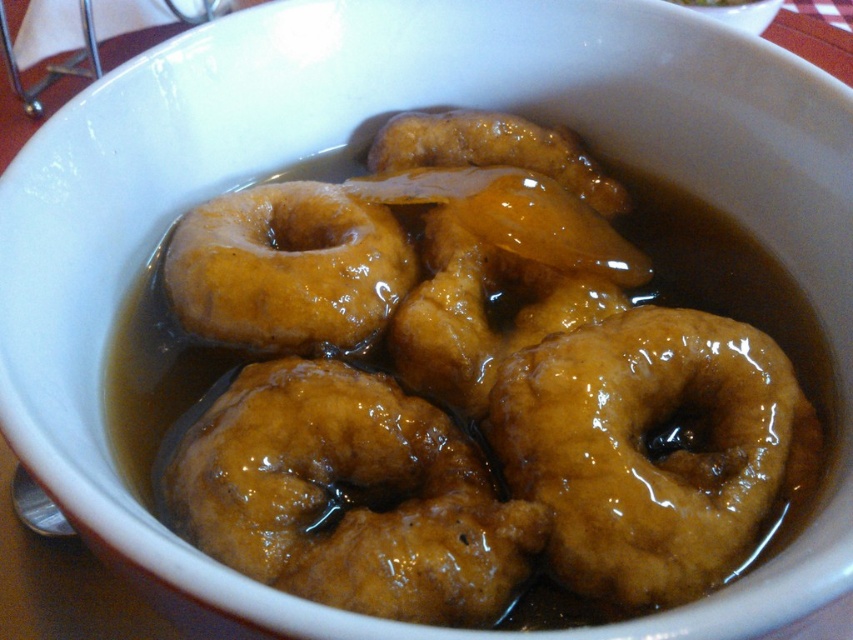
How much distance is there between glossy golden donut at center and golden glazed donut at center?

glossy golden donut at center is 5.85 inches away from golden glazed donut at center.

Between glossy golden donut at center and golden glazed donut at center, which one is positioned higher?

golden glazed donut at center is higher up.

Is point (213, 515) behind point (225, 230)?

No, (213, 515) is in front of (225, 230).

This screenshot has width=853, height=640. In order to click on glossy golden donut at center in this screenshot , I will do `click(350, 497)`.

Between point (653, 426) and point (260, 227), which one is positioned behind?

The point (260, 227) is behind.

Is golden brown glazed donut at center shorter than golden glazed donut at center?

In fact, golden brown glazed donut at center may be taller than golden glazed donut at center.

Measure the distance between point (605,387) and camera.

The distance of point (605,387) from camera is 61.31 centimeters.

Identify the location of golden brown glazed donut at center. (646, 448).

Which is more to the left, glossy golden donut at center or golden brown glazed donut at center?

Positioned to the left is glossy golden donut at center.

Does glossy golden donut at center appear on the right side of golden brown glazed donut at center?

In fact, glossy golden donut at center is to the left of golden brown glazed donut at center.

In order to click on glossy golden donut at center in this screenshot , I will do `click(350, 497)`.